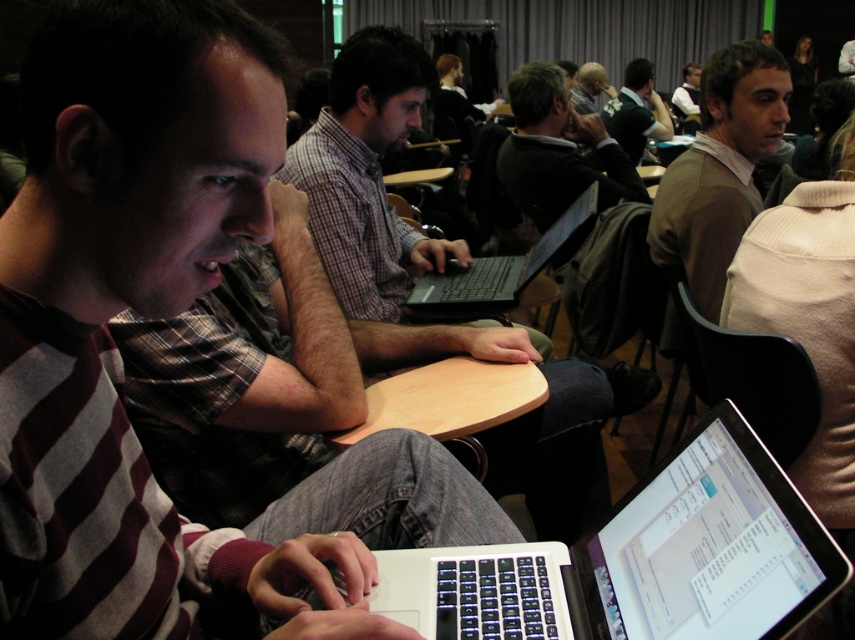
The height and width of the screenshot is (640, 855). What do you see at coordinates (752, 376) in the screenshot?
I see `black plastic chair at lower right` at bounding box center [752, 376].

Who is positioned more to the right, black plastic chair at lower right or wooden table at center?

From the viewer's perspective, black plastic chair at lower right appears more on the right side.

You are a GUI agent. You are given a task and a screenshot of the screen. Output one action in this format:
    pyautogui.click(x=<x>, y=<y>)
    Task: Click on the black plastic chair at lower right
    The height and width of the screenshot is (640, 855).
    Given the screenshot: What is the action you would take?
    point(752,376)

Is dark green sweater at center to the right of black matte laptop at center from the viewer's perspective?

Indeed, dark green sweater at center is positioned on the right side of black matte laptop at center.

Can you confirm if dark green sweater at center is positioned above black matte laptop at center?

Yes, dark green sweater at center is above black matte laptop at center.

Locate an element on the screen. The width and height of the screenshot is (855, 640). dark green sweater at center is located at coordinates (558, 150).

Is plaid shirt at center closer to the viewer compared to black matte laptop at center?

Yes, it is in front of black matte laptop at center.

Does plaid shirt at center appear over black matte laptop at center?

Incorrect, plaid shirt at center is not positioned above black matte laptop at center.

Find the location of a particular element. The height and width of the screenshot is (640, 855). plaid shirt at center is located at coordinates (440, 272).